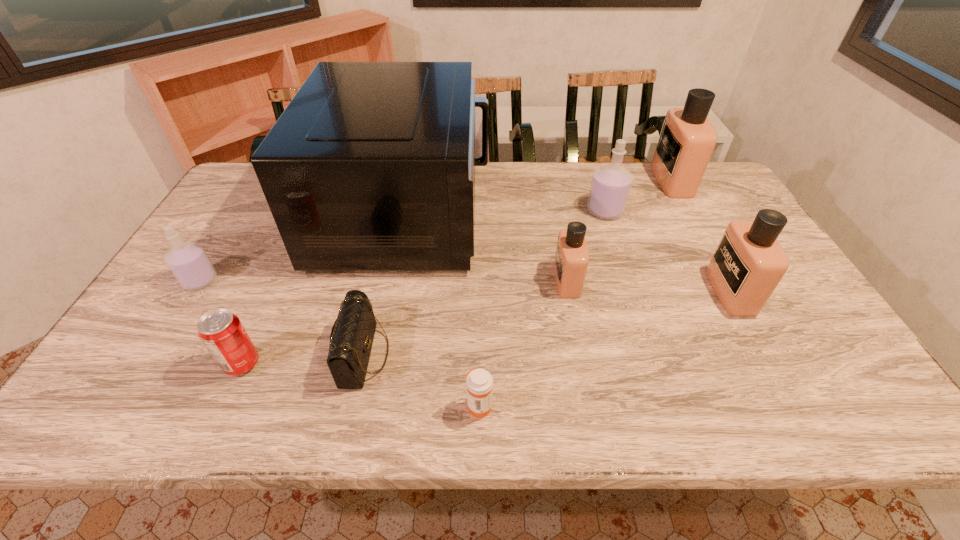
Locate an element on the screen. Image resolution: width=960 pixels, height=540 pixels. the second closest perfume to the seventh tallest object is located at coordinates click(571, 261).

Locate an element on the screen. perfume that stands as the closest to the clutch bag is located at coordinates (189, 263).

Where is `beige perfume that is the closest to the clutch bag`? The height and width of the screenshot is (540, 960). beige perfume that is the closest to the clutch bag is located at coordinates (571, 261).

In order to click on beige perfume that is the second closest to the clutch bag in this screenshot , I will do `click(749, 262)`.

At what (x,y) coordinates should I click in order to perform the action: click on vacant space that satisfies the following two spatial constraints: 1. on the front label of the tallest perfume; 2. on the front side of the nearest object. Please return your answer as a coordinate pair (x, y). This screenshot has height=540, width=960. Looking at the image, I should click on (798, 406).

At what (x,y) coordinates should I click in order to perform the action: click on vacant space that satisfies the following two spatial constraints: 1. on the front flap of the clutch bag; 2. on the right side of the medicine. Please return your answer as a coordinate pair (x, y). Looking at the image, I should click on (352, 406).